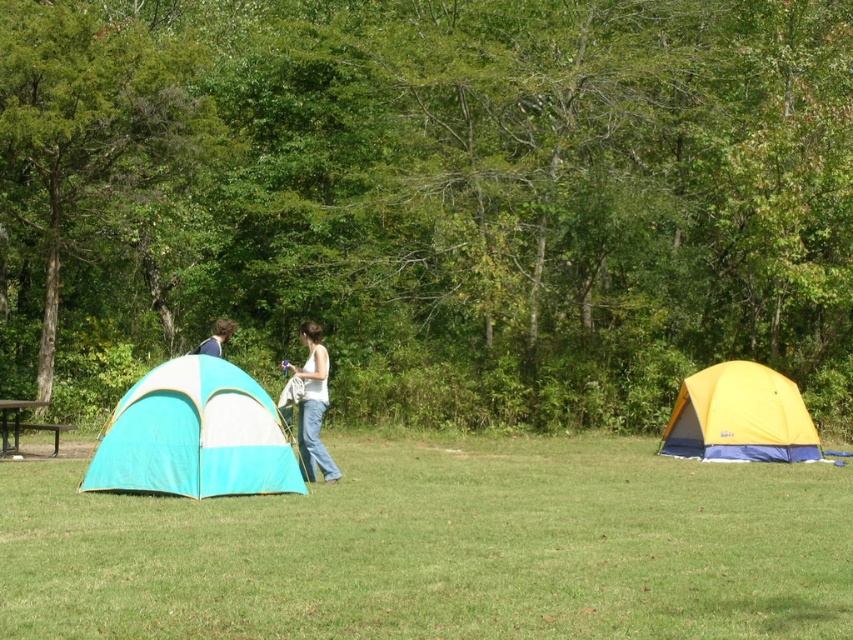
You are at the point marked by coordinates point (x=194, y=435) in the image. Which object are you standing next to?

You are standing next to the teal fabric tent at left as the coordinates point (x=194, y=435) corresponds to it.

You are a camper who wants to place a 3.5 feet wide backpack between the teal fabric tent at left and the white cotton tank top at center. Is there enough space for the backpack?

The teal fabric tent at left is 4.68 feet from the white cotton tank top at center. Since the backpack is 3.5 feet wide, there is enough space to place it between them as the distance between the two objects is greater than the backpack width.